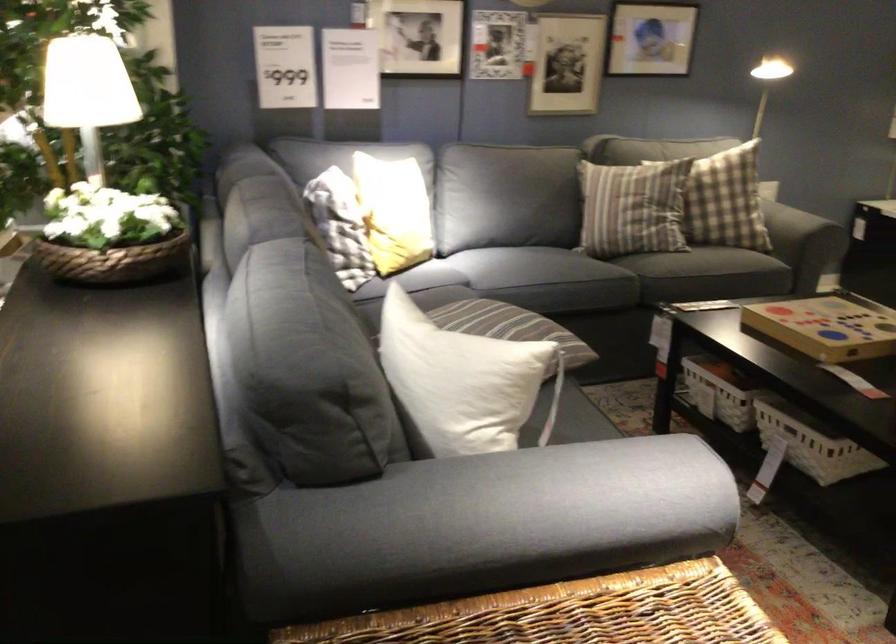
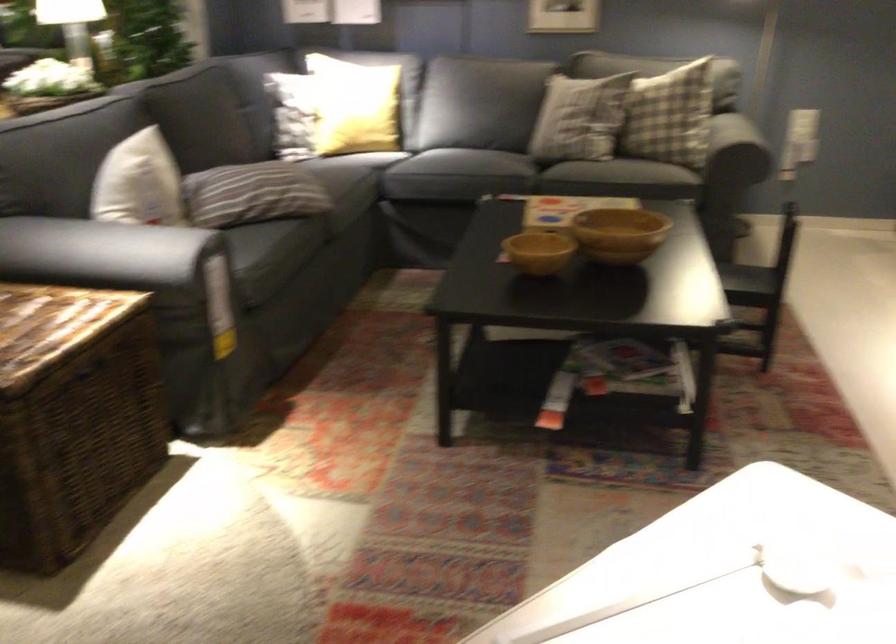
In the second image, find the point that corresponds to point 492,361 in the first image.

(139, 183)